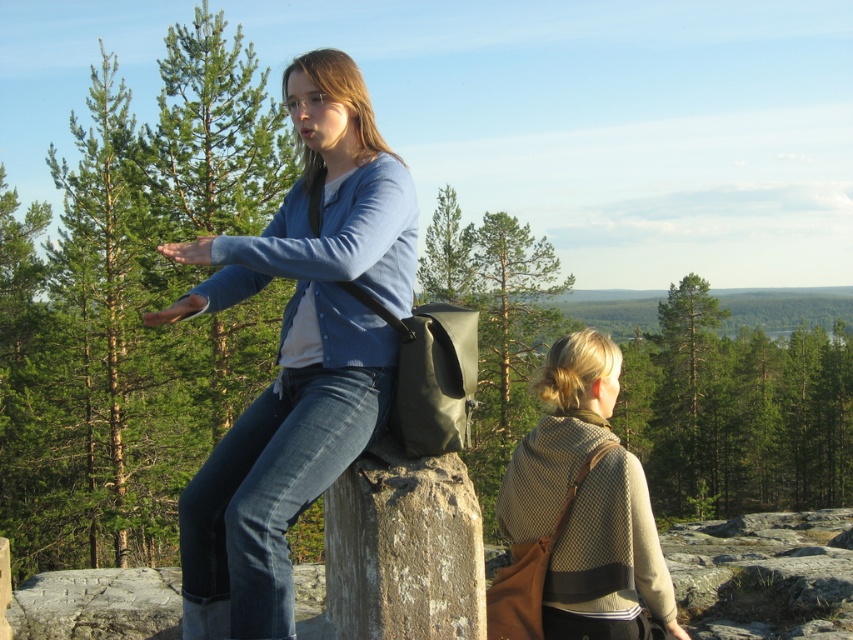
Measure the distance between matte blue shirt at center and beige woolen shawl at center.

7.41 feet

Is matte blue shirt at center closer to camera compared to beige woolen shawl at center?

Yes.

Which is in front, point (370, 406) or point (561, 579)?

Positioned in front is point (370, 406).

Locate an element on the screen. Image resolution: width=853 pixels, height=640 pixels. matte blue shirt at center is located at coordinates (297, 353).